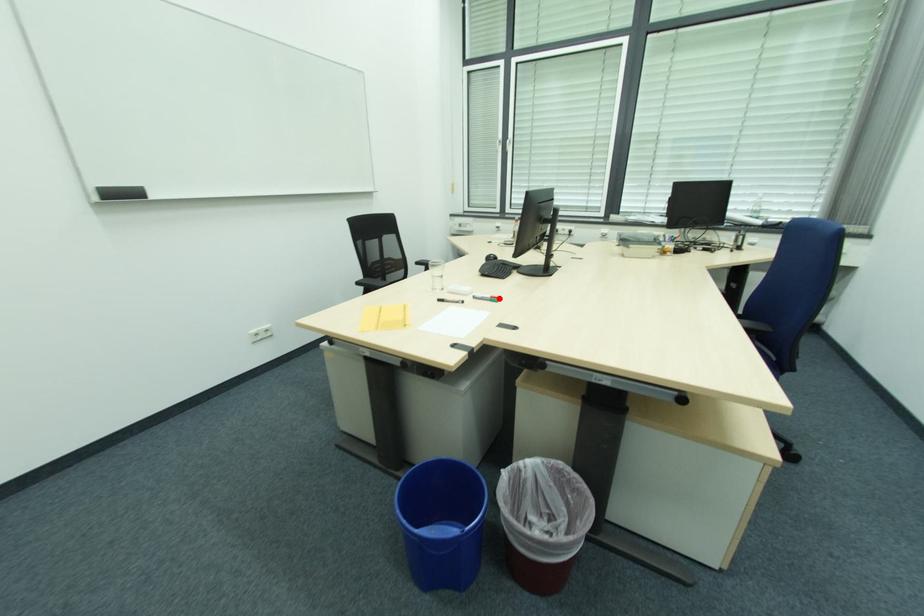
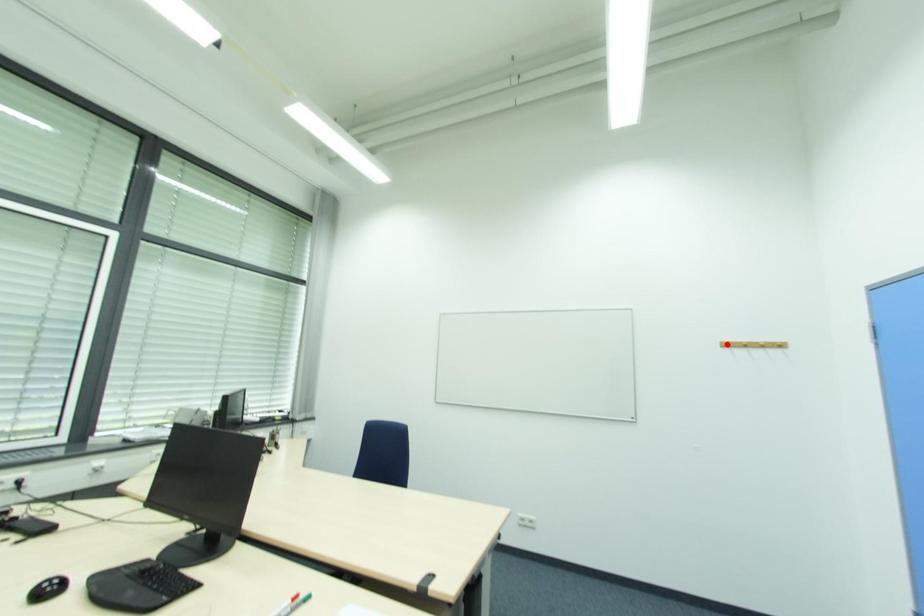
I am providing you with two images of the same scene from different viewpoints. A red point is marked on the first image and another point is marked on the second image. Is the marked point in image1 the same physical position as the marked point in image2?

No